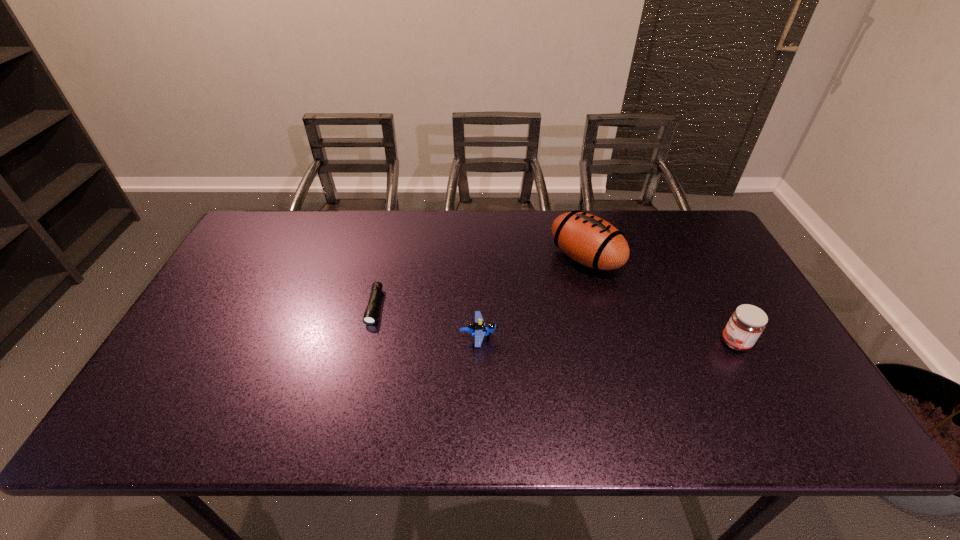
The width and height of the screenshot is (960, 540). I want to click on free location at the far right corner, so click(x=704, y=224).

At what (x,y) coordinates should I click in order to perform the action: click on blank region between the second object from right to left and the second object from left to right. Please return your answer as a coordinate pair (x, y). This screenshot has width=960, height=540. Looking at the image, I should click on (532, 298).

Image resolution: width=960 pixels, height=540 pixels. I want to click on free spot between the farthest object and the jam, so click(x=660, y=300).

Image resolution: width=960 pixels, height=540 pixels. I want to click on empty location between the flashlight and the third object from right to left, so click(426, 322).

I want to click on blank region between the third object from left to right and the third tallest object, so click(x=532, y=298).

In order to click on vacant region between the jam and the third object from right to left in this screenshot , I will do `click(607, 340)`.

In order to click on vacant area that lies between the second object from right to left and the jam in this screenshot , I will do `click(660, 300)`.

Locate an element on the screen. vacant space in between the flashlight and the rightmost object is located at coordinates (555, 325).

At what (x,y) coordinates should I click in order to perform the action: click on free space between the farthest object and the second tallest object. Please return your answer as a coordinate pair (x, y). The height and width of the screenshot is (540, 960). Looking at the image, I should click on (660, 300).

Locate an element on the screen. This screenshot has width=960, height=540. vacant region between the second shortest object and the tallest object is located at coordinates (532, 298).